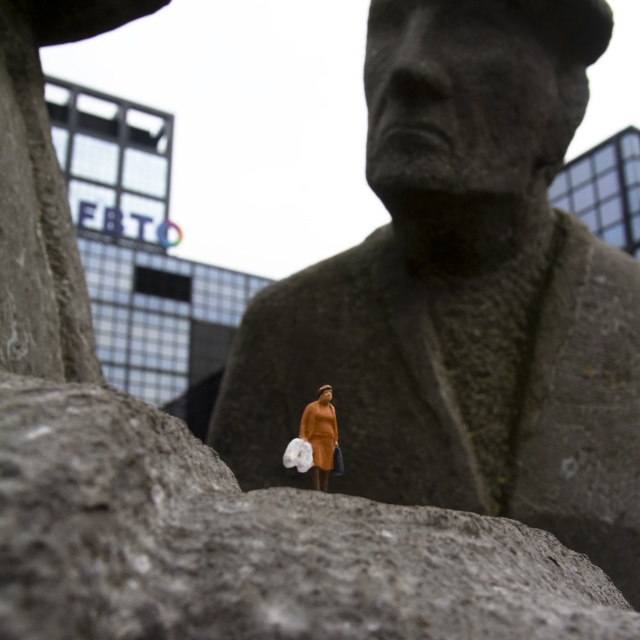
Question: Is matte gray stone bust at center to the left of orange fabric dress at center from the viewer's perspective?

Choices:
 (A) no
 (B) yes

Answer: (A)

Question: Is matte gray stone bust at center below orange fabric dress at center?

Choices:
 (A) no
 (B) yes

Answer: (A)

Question: Which object appears closest to the camera in this image?

Choices:
 (A) orange fabric dress at center
 (B) matte gray stone bust at center

Answer: (A)

Question: Is matte gray stone bust at center to the right of orange fabric dress at center from the viewer's perspective?

Choices:
 (A) yes
 (B) no

Answer: (A)

Question: Which of the following is the farthest from the observer?

Choices:
 (A) orange fabric dress at center
 (B) matte gray stone bust at center

Answer: (B)